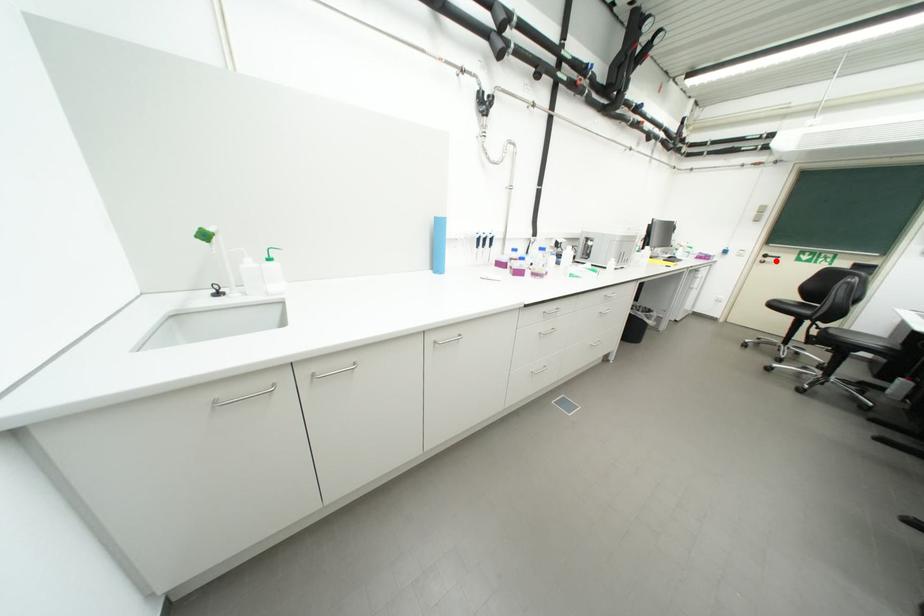
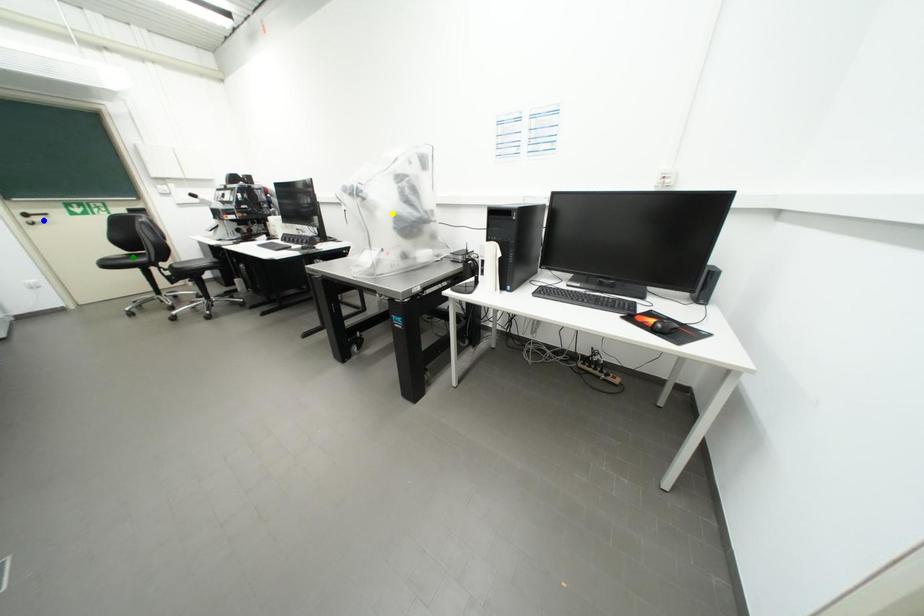
Question: I am providing you with two images of the same scene from different viewpoints. A red point is marked on the first image. You are given multiple points on the second image. Which point in image 2 is actually the same real-world point as the red point in image 1?

Choices:
 (A) blue point
 (B) yellow point
 (C) green point

Answer: (A)